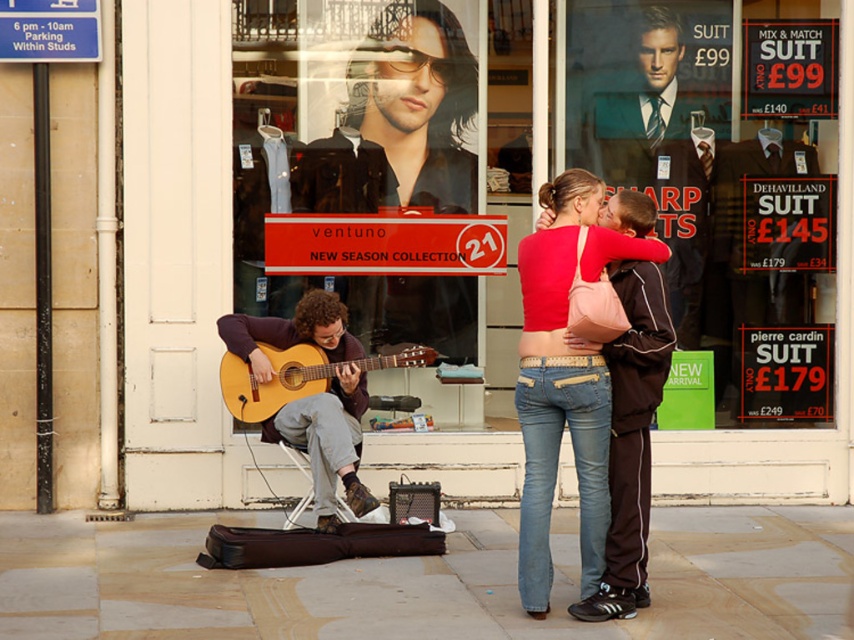
Which of these two, glass display at center or matte black guitar at center, stands taller?

glass display at center is taller.

This screenshot has width=854, height=640. What are the coordinates of `glass display at center` in the screenshot? It's located at (572, 152).

Who is more distant from viewer, (738, 232) or (300, 273)?

The point (738, 232) is more distant.

Find the location of a particular element. This screenshot has height=640, width=854. glass display at center is located at coordinates (572, 152).

Can you confirm if glass display at center is taller than acoustic wood guitar at center?

Correct, glass display at center is much taller as acoustic wood guitar at center.

Does point (806, 268) come behind point (338, 365)?

Yes, it is behind point (338, 365).

You are a GUI agent. You are given a task and a screenshot of the screen. Output one action in this format:
    pyautogui.click(x=<x>, y=<y>)
    Task: Click on the glass display at center
    This screenshot has height=640, width=854.
    Given the screenshot: What is the action you would take?
    pyautogui.click(x=572, y=152)

Between matte black guitar at center and acoustic guitar at center, which one has more height?

With more height is matte black guitar at center.

Does matte black guitar at center have a greater height compared to acoustic guitar at center?

Yes, matte black guitar at center is taller than acoustic guitar at center.

Which is in front, point (278, 157) or point (250, 369)?

Positioned in front is point (250, 369).

Image resolution: width=854 pixels, height=640 pixels. I want to click on matte black guitar at center, so click(x=357, y=148).